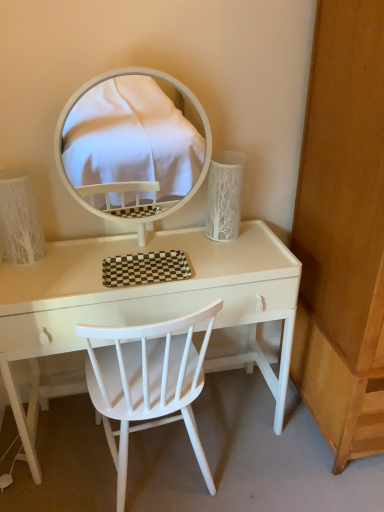
Locate an element on the screen. The height and width of the screenshot is (512, 384). free space to the right of white textured lampshade at left, which appears as the 2th table lamp when viewed from the right is located at coordinates (81, 257).